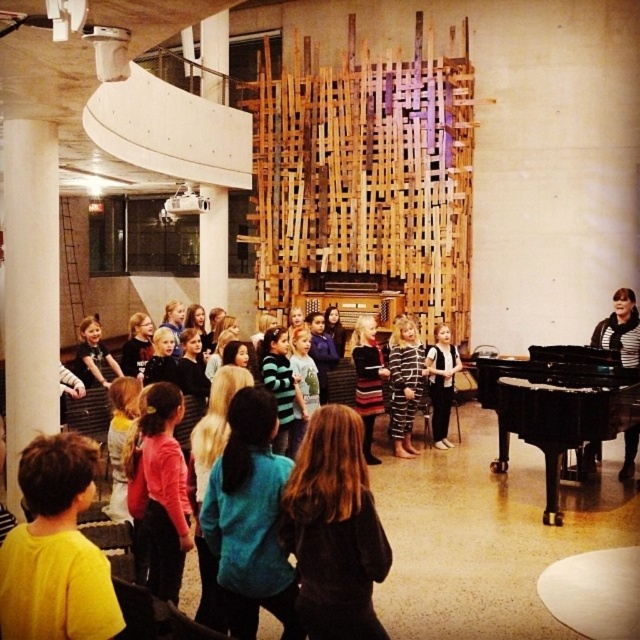
Is pink fabric shirt at center wider than striped fabric dress at center?

Yes, pink fabric shirt at center is wider than striped fabric dress at center.

Between point (170, 417) and point (435, 355), which one is positioned in front?

Point (170, 417)

This screenshot has width=640, height=640. I want to click on pink fabric shirt at center, so click(160, 486).

The width and height of the screenshot is (640, 640). I want to click on black polished piano at right, so click(x=556, y=410).

Does black polished piano at right have a lesser width compared to striped fabric dress at center?

Incorrect, black polished piano at right's width is not less than striped fabric dress at center's.

What are the coordinates of `black polished piano at right` in the screenshot? It's located at (556, 410).

Is the position of black polished piano at right more distant than that of pink fabric shirt at center?

Yes, it is behind pink fabric shirt at center.

Between black polished piano at right and pink fabric shirt at center, which one has more height?

black polished piano at right

Between point (560, 449) and point (182, 531), which one is positioned behind?

Positioned behind is point (560, 449).

At what (x,y) coordinates should I click in order to perform the action: click on black polished piano at right. Please return your answer as a coordinate pair (x, y). Looking at the image, I should click on [x=556, y=410].